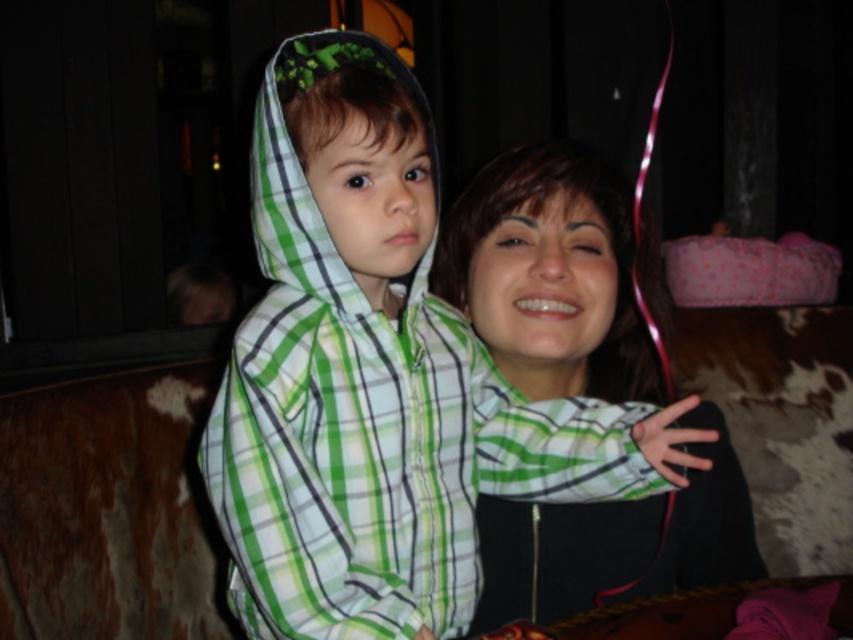
Is green plaid hoodie at center thinner than matte green plaid shirt at center?

Yes, green plaid hoodie at center is thinner than matte green plaid shirt at center.

Who is positioned more to the left, green plaid hoodie at center or matte green plaid shirt at center?

From the viewer's perspective, green plaid hoodie at center appears more on the left side.

Is point (315, 492) positioned after point (469, 257)?

No, (315, 492) is in front of (469, 257).

Where is `green plaid hoodie at center`? Image resolution: width=853 pixels, height=640 pixels. green plaid hoodie at center is located at coordinates (378, 387).